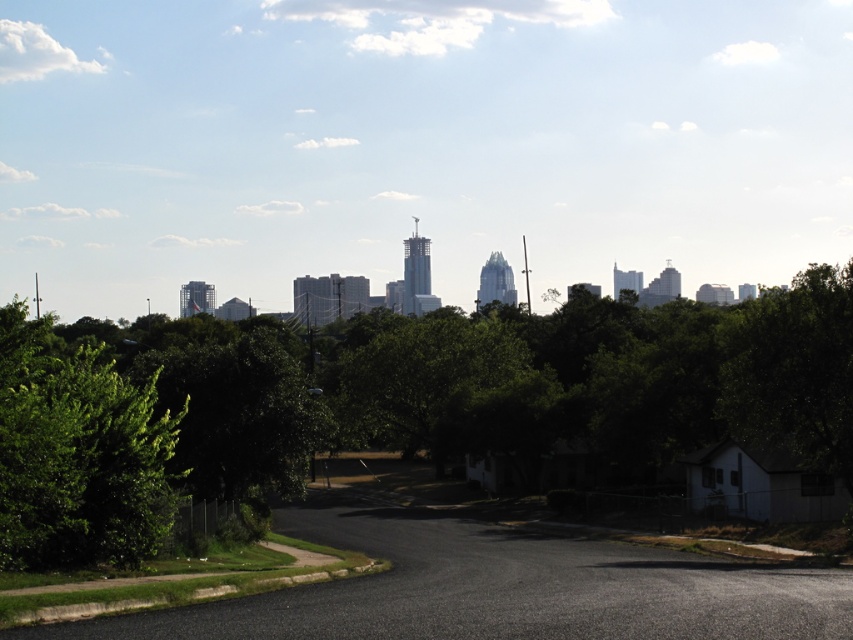
Based on the photo, does green leafy tree at center have a smaller size compared to green leafy tree at left?

Actually, green leafy tree at center might be larger than green leafy tree at left.

Between point (630, 448) and point (10, 435), which one is positioned behind?

Positioned behind is point (630, 448).

Describe the element at coordinates (421, 404) in the screenshot. I see `green leafy tree at center` at that location.

Image resolution: width=853 pixels, height=640 pixels. What are the coordinates of `green leafy tree at center` in the screenshot? It's located at (421, 404).